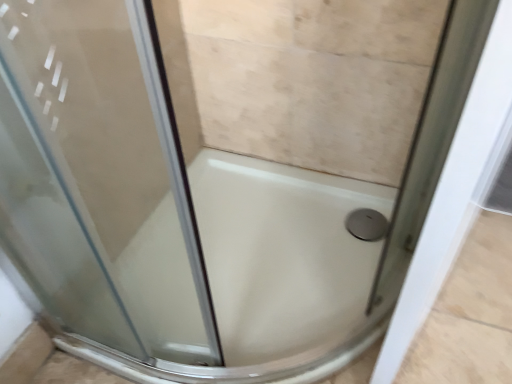
At what (x,y) coordinates should I click in order to perform the action: click on white glossy bath at center. Please return your answer as a coordinate pair (x, y). The width and height of the screenshot is (512, 384). Looking at the image, I should click on (282, 268).

What do you see at coordinates (282, 268) in the screenshot?
I see `white glossy bath at center` at bounding box center [282, 268].

Find the location of `satin silver drain at bottom right`. satin silver drain at bottom right is located at coordinates (367, 224).

This screenshot has height=384, width=512. What do you see at coordinates (367, 224) in the screenshot? I see `satin silver drain at bottom right` at bounding box center [367, 224].

Identify the location of white glossy bath at center. (282, 268).

Considering the positions of objects white glossy bath at center and satin silver drain at bottom right in the image provided, who is more to the right, white glossy bath at center or satin silver drain at bottom right?

Positioned to the right is satin silver drain at bottom right.

Is white glossy bath at center behind satin silver drain at bottom right?

No, white glossy bath at center is closer to the viewer.

Is point (277, 267) farther from viewer compared to point (373, 214)?

No.

From the image's perspective, is white glossy bath at center under satin silver drain at bottom right?

Yes.

In the scene shown: From a real-world perspective, which object rests below the other?

satin silver drain at bottom right.

Considering the relative sizes of white glossy bath at center and satin silver drain at bottom right in the image provided, is white glossy bath at center thinner than satin silver drain at bottom right?

No.

Is white glossy bath at center taller than satin silver drain at bottom right?

Yes.

Does white glossy bath at center have a larger size compared to satin silver drain at bottom right?

Indeed, white glossy bath at center has a larger size compared to satin silver drain at bottom right.

Is satin silver drain at bottom right completely or partially inside white glossy bath at center?

Yes.

Would you consider white glossy bath at center to be distant from satin silver drain at bottom right?

No.

Is white glossy bath at center facing away from satin silver drain at bottom right?

white glossy bath at center is not turned away from satin silver drain at bottom right.

Looking at this image, how different are the orientations of white glossy bath at center and satin silver drain at bottom right in degrees?

→ 179 degrees.

Locate an element on the screen. The height and width of the screenshot is (384, 512). shower that is above the white glossy bath at center (from the image's perspective) is located at coordinates (367, 224).

Considering the positions of objects satin silver drain at bottom right and white glossy bath at center in the image provided, who is more to the left, satin silver drain at bottom right or white glossy bath at center?

white glossy bath at center.

Is satin silver drain at bottom right in front of white glossy bath at center?

No, it is behind white glossy bath at center.

Considering the positions of point (351, 226) and point (234, 259), is point (351, 226) closer or farther from the camera than point (234, 259)?

Point (351, 226).

From the image's perspective, between satin silver drain at bottom right and white glossy bath at center, which one is located above?

satin silver drain at bottom right is shown above in the image.

Consider the image. From a real-world perspective, is satin silver drain at bottom right above or below white glossy bath at center?

Clearly, from a real-world perspective, satin silver drain at bottom right is below white glossy bath at center.

Can you confirm if satin silver drain at bottom right is thinner than white glossy bath at center?

Correct, the width of satin silver drain at bottom right is less than that of white glossy bath at center.

Considering the relative sizes of satin silver drain at bottom right and white glossy bath at center in the image provided, is satin silver drain at bottom right taller than white glossy bath at center?

In fact, satin silver drain at bottom right may be shorter than white glossy bath at center.

Considering the relative sizes of satin silver drain at bottom right and white glossy bath at center in the image provided, is satin silver drain at bottom right smaller than white glossy bath at center?

Yes, satin silver drain at bottom right is smaller than white glossy bath at center.

Can we say satin silver drain at bottom right lies outside white glossy bath at center?

No, satin silver drain at bottom right is inside white glossy bath at center's boundary.

Are satin silver drain at bottom right and white glossy bath at center making contact?

No, satin silver drain at bottom right is not touching white glossy bath at center.

Could you tell me if satin silver drain at bottom right is facing white glossy bath at center?

Yes, satin silver drain at bottom right faces towards white glossy bath at center.

What's the angular difference between satin silver drain at bottom right and white glossy bath at center's facing directions?

The angle between the facing direction of satin silver drain at bottom right and the facing direction of white glossy bath at center is 179 degrees.

How far apart are satin silver drain at bottom right and white glossy bath at center?

A distance of 11.57 inches exists between satin silver drain at bottom right and white glossy bath at center.

At what (x,y) coordinates should I click in order to perform the action: click on bath below the satin silver drain at bottom right (from the image's perspective). Please return your answer as a coordinate pair (x, y). Image resolution: width=512 pixels, height=384 pixels. Looking at the image, I should click on (282, 268).

Locate an element on the screen. The width and height of the screenshot is (512, 384). shower on the right of the white glossy bath at center is located at coordinates (367, 224).

In the image, there is a white glossy bath at center. Identify the location of shower below it (from a real-world perspective). 367,224.